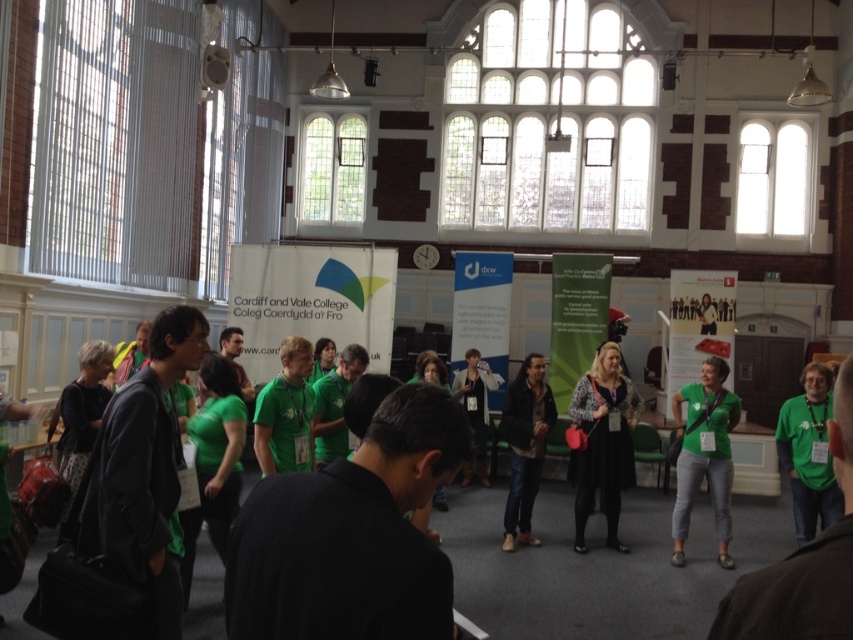
Is point (602, 381) more distant than point (550, 400)?

No.

Between leopard print sweater at center and leather jacket at center, which one is positioned lower?

leather jacket at center

Locate an element on the screen. The width and height of the screenshot is (853, 640). leopard print sweater at center is located at coordinates (602, 442).

What do you see at coordinates (602, 442) in the screenshot?
I see `leopard print sweater at center` at bounding box center [602, 442].

Is leopard print sweater at center above green matte shirt at center?

Correct, leopard print sweater at center is located above green matte shirt at center.

This screenshot has height=640, width=853. I want to click on leopard print sweater at center, so point(602,442).

Find the location of a particular element. This screenshot has width=853, height=640. leopard print sweater at center is located at coordinates (602, 442).

Between green matte shirt at center and leather jacket at center, which one is positioned lower?

green matte shirt at center is below.

Where is `green matte shirt at center`? The width and height of the screenshot is (853, 640). green matte shirt at center is located at coordinates 704,454.

Where is `green matte shirt at center`? The height and width of the screenshot is (640, 853). green matte shirt at center is located at coordinates (704, 454).